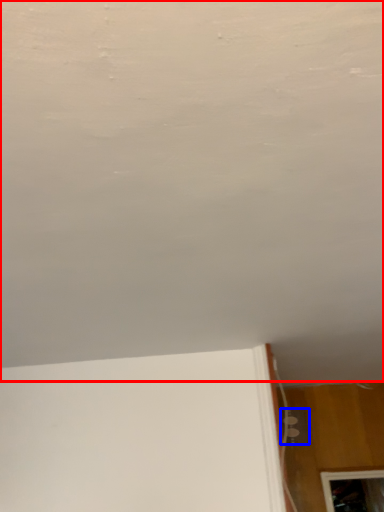
Question: Among these objects, which one is nearest to the camera, backdrop (highlighted by a red box) or electric outlet (highlighted by a blue box)?

Choices:
 (A) backdrop
 (B) electric outlet

Answer: (A)